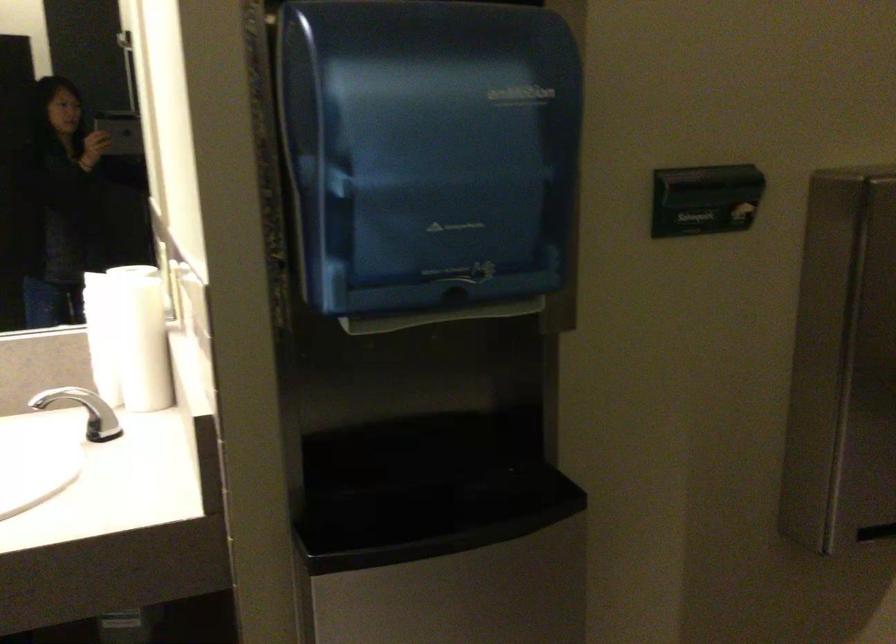
What do you see at coordinates (704, 200) in the screenshot?
I see `the metal dispenser slot` at bounding box center [704, 200].